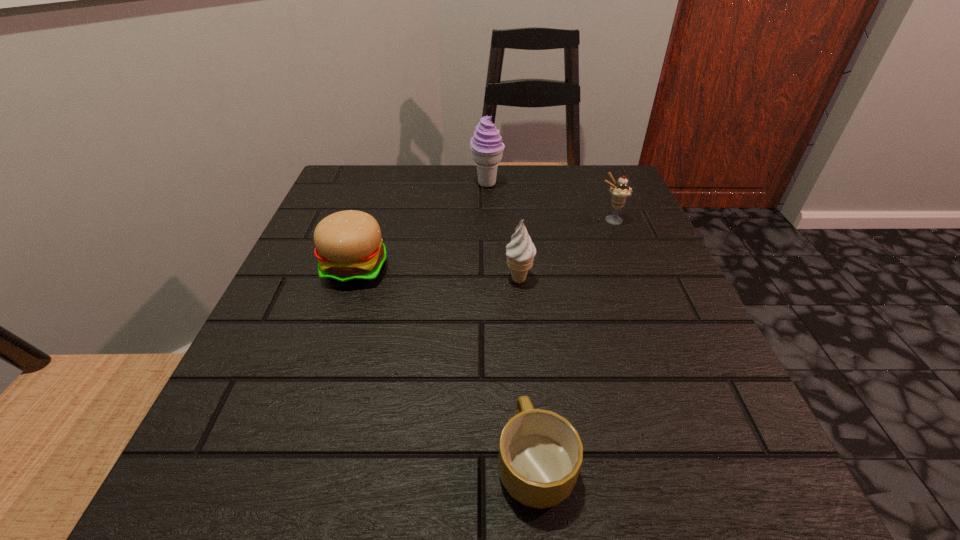
Where is `free space located on the left of the rightmost object`? This screenshot has width=960, height=540. free space located on the left of the rightmost object is located at coordinates click(559, 220).

Identify the location of free space located 0.280m on the right of the hamburger. The height and width of the screenshot is (540, 960). (538, 269).

This screenshot has width=960, height=540. I want to click on vacant space located on the side with the handle of the nearest object, so click(x=515, y=249).

Find the location of a particular element. This screenshot has width=960, height=540. vacant space situated on the side with the handle of the nearest object is located at coordinates (527, 386).

Where is `vacant space situated 0.100m on the side with the handle of the nearest object`? vacant space situated 0.100m on the side with the handle of the nearest object is located at coordinates (524, 359).

Where is `object that is at the near edge`? object that is at the near edge is located at coordinates (540, 454).

Where is `object present at the left edge`? The image size is (960, 540). object present at the left edge is located at coordinates (349, 248).

Find the location of a particular element. object that is at the right edge is located at coordinates (620, 191).

Where is `object that is positioned at the far right corner`? object that is positioned at the far right corner is located at coordinates click(x=620, y=191).

This screenshot has height=540, width=960. Identify the location of vacant space at the far edge of the desktop. (535, 202).